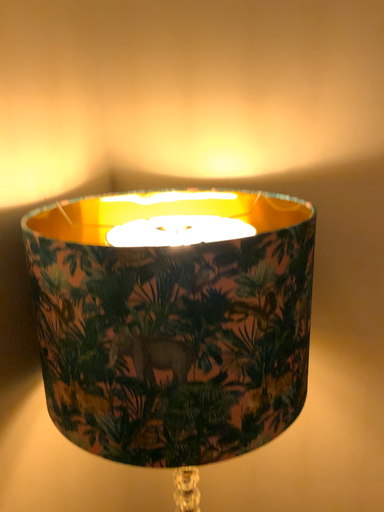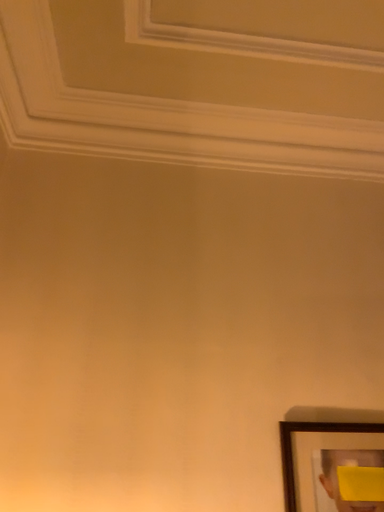
Question: How did the camera likely rotate when shooting the video?

Choices:
 (A) rotated right
 (B) rotated left

Answer: (A)